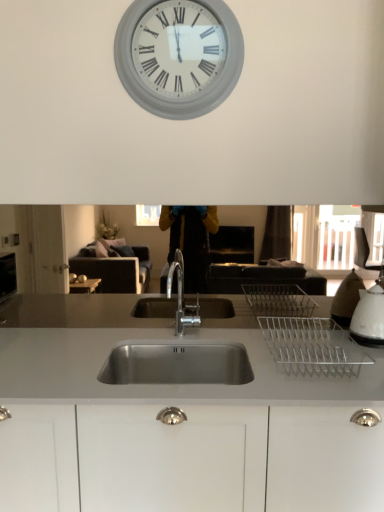
Question: Is point (64, 501) closer or farther from the camera than point (357, 324)?

Choices:
 (A) closer
 (B) farther

Answer: (A)

Question: Is stainless steel sink at center situated inside white glossy kettle at right or outside?

Choices:
 (A) inside
 (B) outside

Answer: (B)

Question: Which object is the closest to the stainless steel sink at center?

Choices:
 (A) white matte clock at upper center
 (B) white glossy kettle at right

Answer: (B)

Question: Which is farther from the white matte clock at upper center?

Choices:
 (A) white glossy kettle at right
 (B) stainless steel sink at center

Answer: (A)